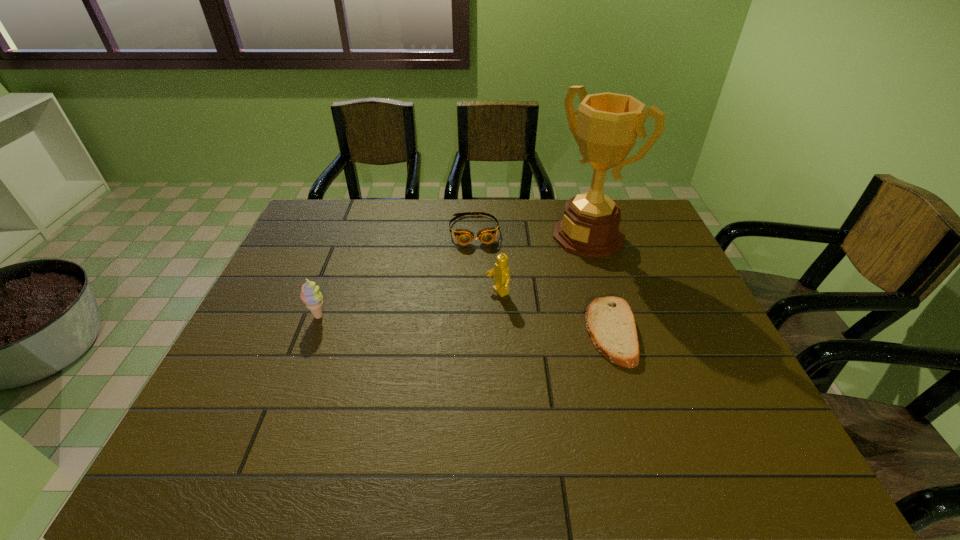
At what (x,y) coordinates should I click in order to perform the action: click on vacant area situated 0.210m with the lenses facing forward on the second shortest object. Please return your answer as a coordinate pair (x, y). The width and height of the screenshot is (960, 540). Looking at the image, I should click on (483, 293).

Find the location of `vacant area located 0.190m with the lenses facing forward on the second shortest object`. vacant area located 0.190m with the lenses facing forward on the second shortest object is located at coordinates (482, 288).

The width and height of the screenshot is (960, 540). I want to click on free space located 0.100m with the lenses facing forward on the second shortest object, so click(x=479, y=268).

You are a GUI agent. You are given a task and a screenshot of the screen. Output one action in this format:
    pyautogui.click(x=<x>, y=<y>)
    Task: Click on the vacant space located on the face of the Lego
    The height and width of the screenshot is (540, 960).
    Given the screenshot: What is the action you would take?
    pyautogui.click(x=428, y=323)

I want to click on vacant space situated on the face of the Lego, so click(x=465, y=307).

Identify the location of blank area located on the face of the Lego. Image resolution: width=960 pixels, height=540 pixels. (366, 351).

At what (x,y) coordinates should I click in order to perform the action: click on award at the far edge. Please return your answer as a coordinate pair (x, y). This screenshot has height=540, width=960. Looking at the image, I should click on (608, 124).

Find the location of a particular element. This screenshot has height=540, width=960. goggles located in the far edge section of the desktop is located at coordinates (487, 235).

Find the location of a particular element. The height and width of the screenshot is (540, 960). object at the left edge is located at coordinates (310, 295).

You are a GUI agent. You are given a task and a screenshot of the screen. Output one action in this format:
    pyautogui.click(x=<x>, y=<y>)
    Task: Click on the object that is at the right edge
    
    Given the screenshot: What is the action you would take?
    pyautogui.click(x=608, y=124)